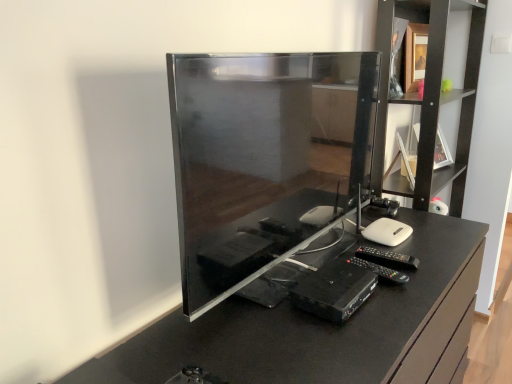
Where is `free space behind black plastic dvd player at center`? This screenshot has width=512, height=384. free space behind black plastic dvd player at center is located at coordinates pyautogui.click(x=325, y=263).